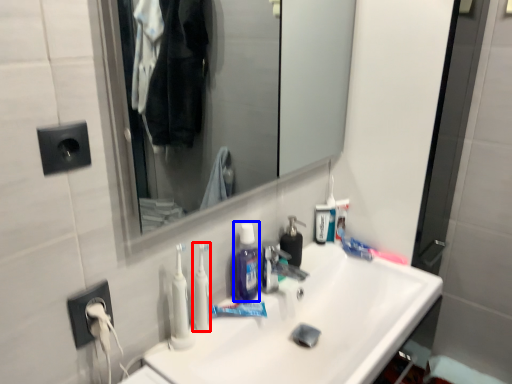
Question: Which object is further to the camera taking this photo, toothbrush (highlighted by a red box) or mouthwash (highlighted by a blue box)?

Choices:
 (A) toothbrush
 (B) mouthwash

Answer: (B)